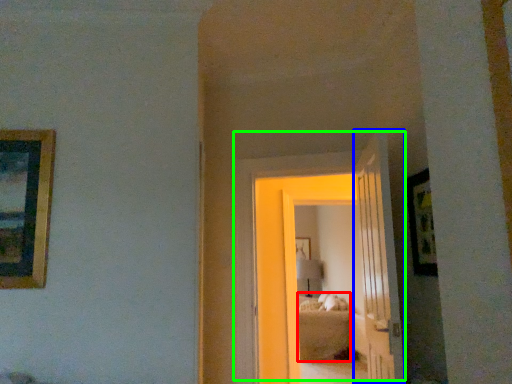
Question: Considering the real-world distances, which object is closest to bed (highlighted by a red box)? door (highlighted by a blue box) or door (highlighted by a green box).

Choices:
 (A) door
 (B) door

Answer: (B)